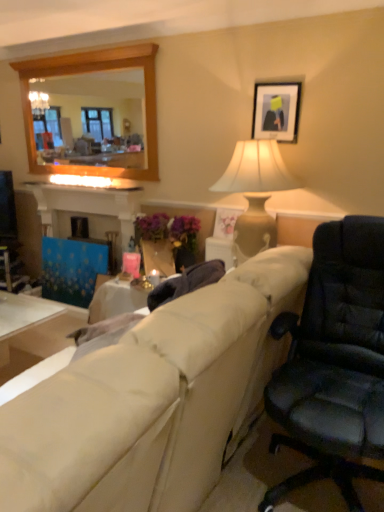
Where is `free space above wooden frame mirror at upper left (from a real-world perspective)`? The width and height of the screenshot is (384, 512). free space above wooden frame mirror at upper left (from a real-world perspective) is located at coordinates (73, 52).